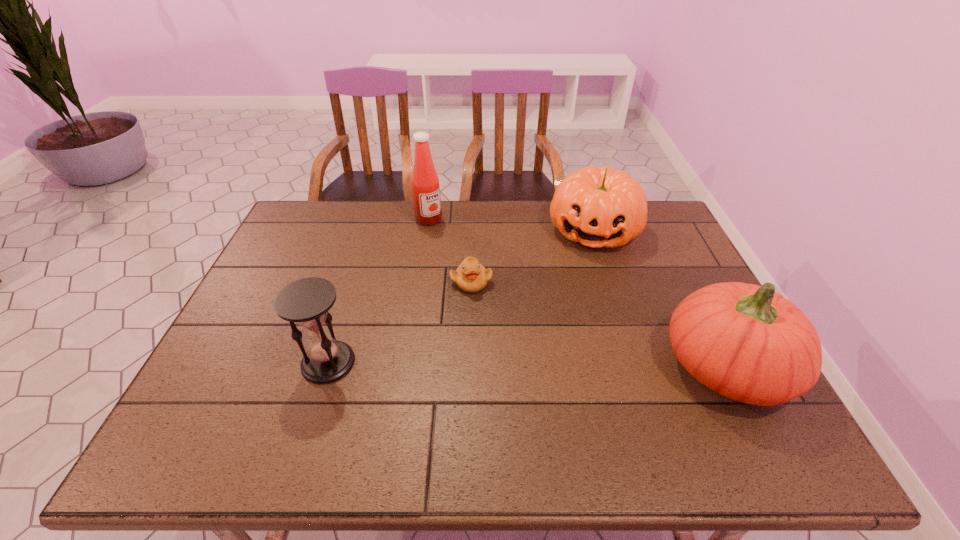
Identify the location of free space at the near right corner of the desktop. point(727,411).

The width and height of the screenshot is (960, 540). I want to click on free spot between the tallest object and the hourglass, so click(378, 291).

Identify the location of vacant area between the third object from right to left and the tallest object. The image size is (960, 540). (450, 251).

Locate an element on the screen. Image resolution: width=960 pixels, height=540 pixels. empty location between the shorter pumpkin and the taller pumpkin is located at coordinates (660, 298).

What are the coordinates of `free point between the tallest object and the shorter pumpkin` in the screenshot? It's located at coord(512,225).

At what (x,y) coordinates should I click in order to perform the action: click on free space between the taller pumpkin and the tallest object. Please return your answer as a coordinate pair (x, y). The width and height of the screenshot is (960, 540). Looking at the image, I should click on point(578,293).

Where is `free space between the tallest object and the shorter pumpkin`? This screenshot has width=960, height=540. free space between the tallest object and the shorter pumpkin is located at coordinates (512, 225).

This screenshot has width=960, height=540. Identify the location of free space between the duckling and the nearer pumpkin. (599, 324).

Where is `free area in between the nearer pumpkin and the hourglass`? This screenshot has height=540, width=960. free area in between the nearer pumpkin and the hourglass is located at coordinates (527, 364).

Where is `free space between the third object from left to right and the farther pumpkin`? Image resolution: width=960 pixels, height=540 pixels. free space between the third object from left to right and the farther pumpkin is located at coordinates (533, 256).